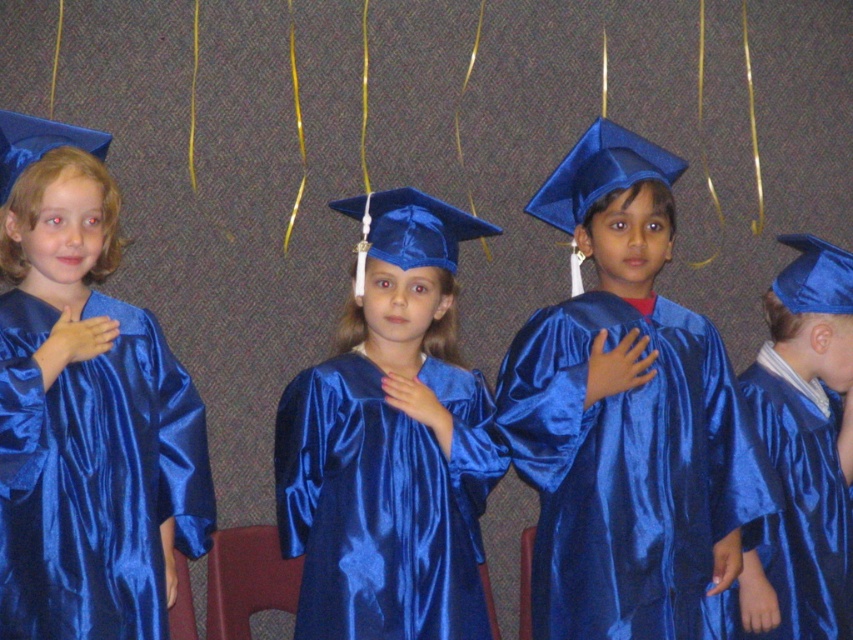
Is the position of shiny blue gown at center more distant than that of shiny blue graduation gown at center?

That is False.

Is point (666, 307) closer to camera compared to point (824, 470)?

Yes, it is in front of point (824, 470).

Describe the element at coordinates (625, 416) in the screenshot. The width and height of the screenshot is (853, 640). I see `shiny blue gown at center` at that location.

Locate an element on the screen. This screenshot has width=853, height=640. shiny blue gown at center is located at coordinates pos(625,416).

Is shiny blue gown at center in front of satin blue gown at center?

No, it is not.

Describe the element at coordinates (625, 416) in the screenshot. I see `shiny blue gown at center` at that location.

Find the location of a particular element. This screenshot has width=853, height=640. shiny blue gown at center is located at coordinates (625, 416).

Is shiny blue graduation gown at center taller than blue satin cap at upper right?

Yes.

Can you confirm if shiny blue graduation gown at center is bigger than blue satin cap at upper right?

Correct, shiny blue graduation gown at center is larger in size than blue satin cap at upper right.

Where is `shiny blue graduation gown at center`? Image resolution: width=853 pixels, height=640 pixels. shiny blue graduation gown at center is located at coordinates (804, 448).